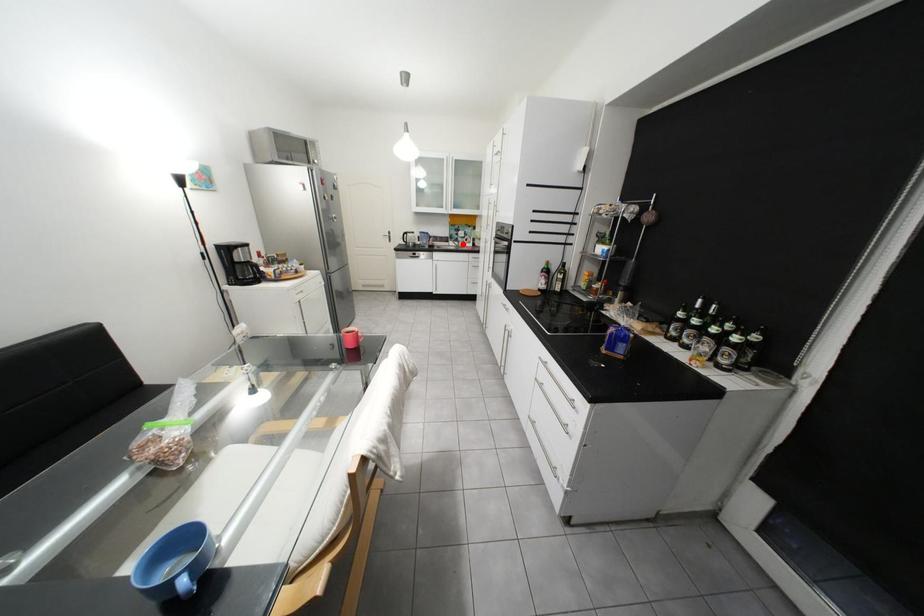
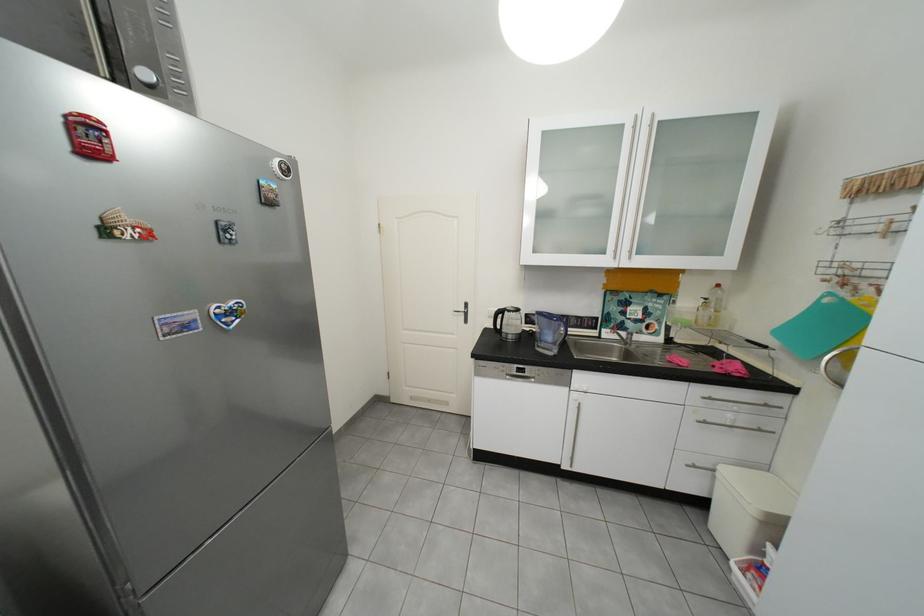
Question: I am providing you with two images of the same scene from different viewpoints. In image1, a red point is highlighted. Considering the same 3D point in image2, which of the following is correct?

Choices:
 (A) It is closer
 (B) It is farther

Answer: (B)